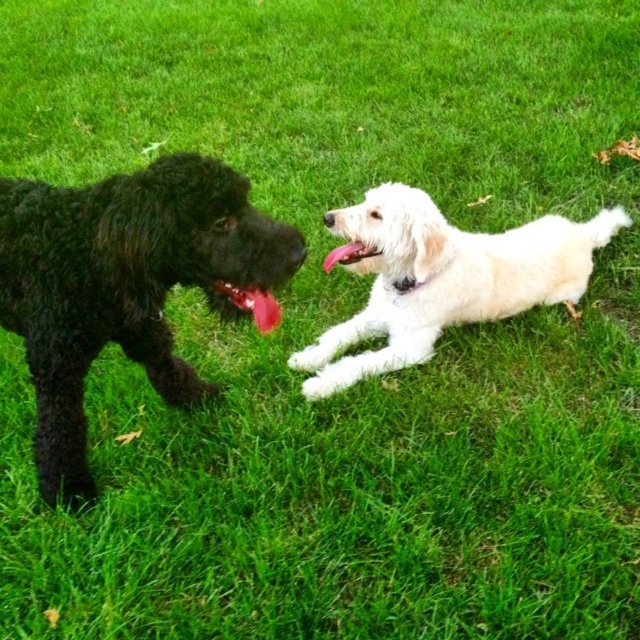
Question: Is shiny black fur at left positioned in front of rubber-like red tongue at center?

Choices:
 (A) yes
 (B) no

Answer: (A)

Question: Is the position of shiny black fur at left more distant than that of rubber-like red tongue at center?

Choices:
 (A) no
 (B) yes

Answer: (A)

Question: Which point is farther to the camera?

Choices:
 (A) (259, 298)
 (B) (124, 196)

Answer: (A)

Question: Which point is closer to the camera taking this photo?

Choices:
 (A) (240, 296)
 (B) (394, 289)

Answer: (A)

Question: Based on their relative distances, which object is nearer to the rubber-like red tongue at center?

Choices:
 (A) shiny black fur at left
 (B) white fluffy dog at center

Answer: (A)

Question: Is shiny black fur at left to the left of rubber-like red tongue at center from the viewer's perspective?

Choices:
 (A) no
 (B) yes

Answer: (B)